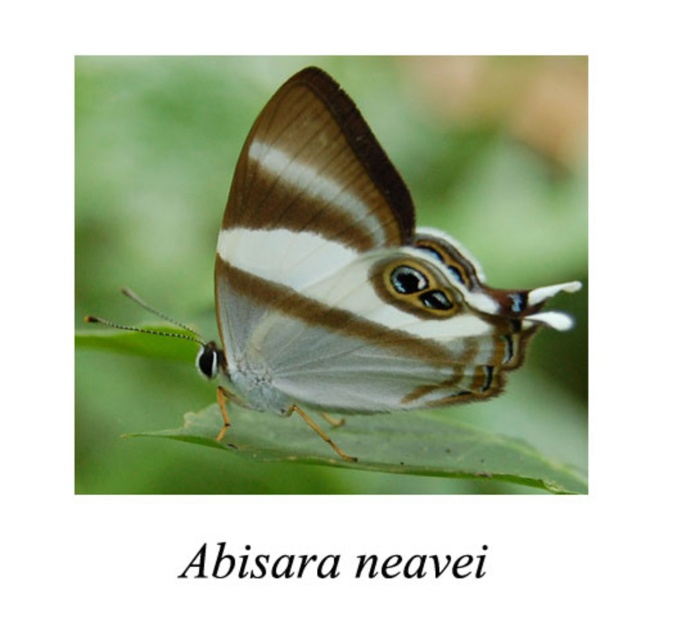
In the scene shown: You are an entomologist observing the butterfly and its leaf. Which object is positioned to the right when looking at the matte brown butterfly at center and the green matte leaf at center?

The green matte leaf at center is positioned to the right of the matte brown butterfly at center.

You are an entomologist observing the matte brown butterfly at center and the green matte leaf at center in the image. Based on their sizes, which object would cast a larger shadow when sunlight is directly overhead?

The matte brown butterfly at center has a greater height compared to the green matte leaf at center, so it would cast a larger shadow when sunlight is directly overhead.

You are an entomologist examining the butterfly. You notice two points on its wings at coordinates point [466,314] and point [525,456]. Which of these points is nearer to your observation lens?

Point [466,314] is closer to the viewer than point [525,456], so the point at [466,314] is nearer to your observation lens.